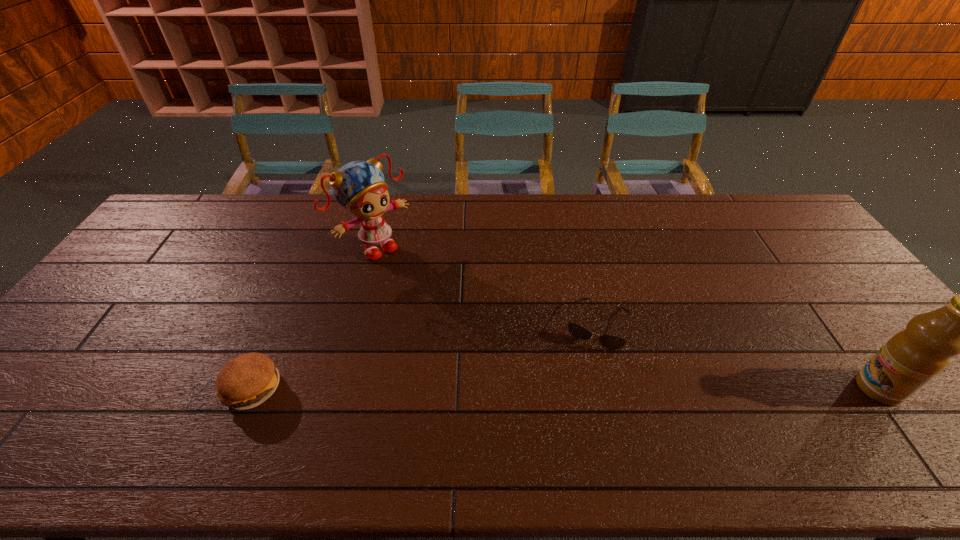
Identify the location of free space located on the label of the olive oil. (737, 388).

Find the location of a particular element. The height and width of the screenshot is (540, 960). free region located 0.110m on the front-facing side of the third object from left to right is located at coordinates (578, 383).

The image size is (960, 540). Identify the location of vacant space located on the front-facing side of the third object from left to right. (572, 403).

Find the location of a particular element. This screenshot has height=540, width=960. free region located 0.150m on the front-facing side of the third object from left to right is located at coordinates (574, 396).

Where is `free space located on the face of the farthest object`? This screenshot has height=540, width=960. free space located on the face of the farthest object is located at coordinates (432, 299).

This screenshot has height=540, width=960. I want to click on free space located 0.200m on the face of the farthest object, so click(x=432, y=299).

Identify the location of vacant space situated on the face of the farthest object. (451, 318).

The width and height of the screenshot is (960, 540). I want to click on object that is at the far edge, so click(359, 186).

You are a GUI agent. You are given a task and a screenshot of the screen. Output one action in this format:
    pyautogui.click(x=<x>, y=<y>)
    Task: Click on the hamburger located in the near edge section of the desktop
    The height and width of the screenshot is (540, 960).
    Given the screenshot: What is the action you would take?
    pyautogui.click(x=245, y=382)

This screenshot has width=960, height=540. What are the coordinates of `olive oil situated at the near edge` in the screenshot? It's located at (911, 358).